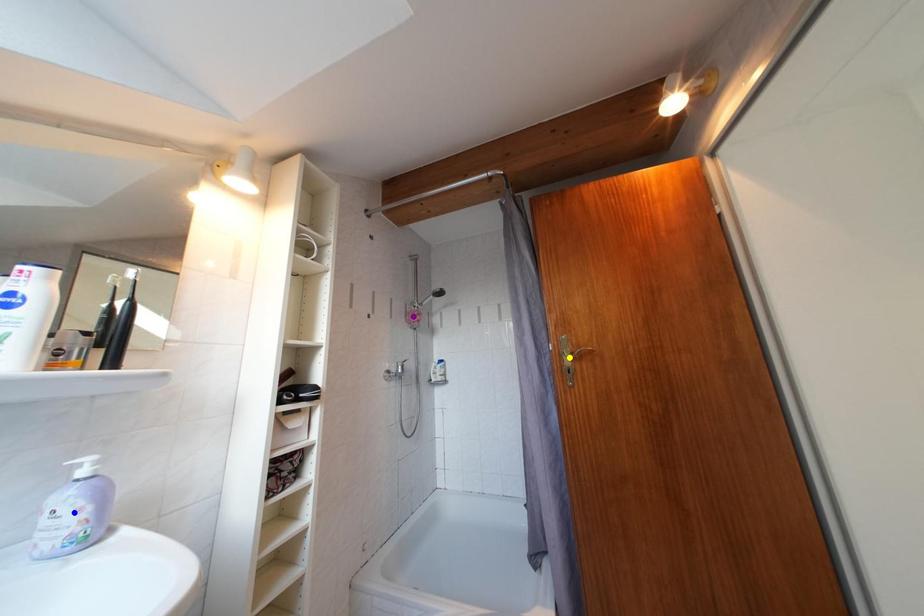
In the scene shown: Order these from nearest to farthest:
A) purple point
B) blue point
C) yellow point

1. purple point
2. yellow point
3. blue point